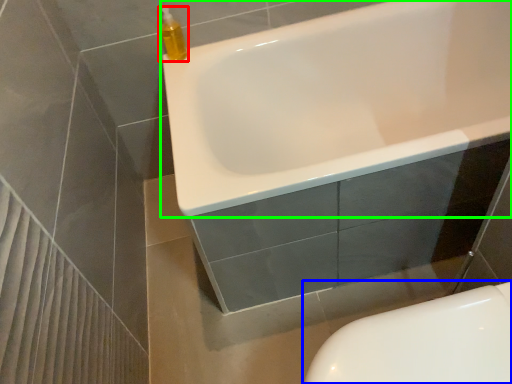
Question: Based on their relative distances, which object is farther from cleaning product (highlighted by a red box)? Choose from toilet (highlighted by a blue box) and bathtub (highlighted by a green box).

Choices:
 (A) toilet
 (B) bathtub

Answer: (A)